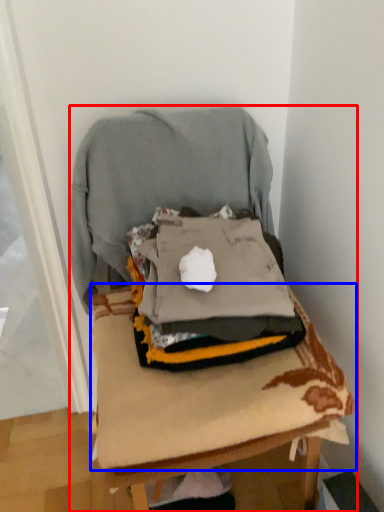
Question: Which point is closer to the camera, furniture (highlighted by a red box) or sheet (highlighted by a blue box)?

Choices:
 (A) furniture
 (B) sheet

Answer: (A)